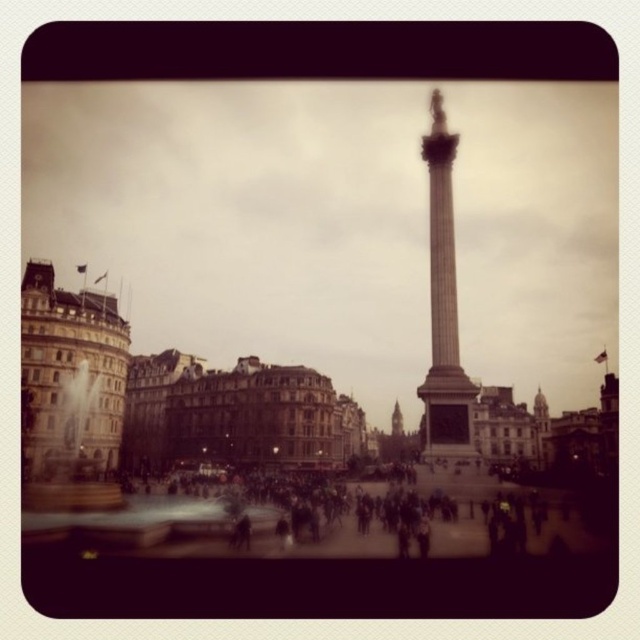
You are a photographer standing at the edge of Trafalgar Square. You want to capture a clear shot of the smooth stone column at center without any obstructions from the dark clothing crowd at center. Based on their relative heights, is it possible to frame the shot so the column remains fully visible?

The dark clothing crowd at center is shorter than the smooth stone column at center, so yes, it is possible to frame the shot so the column remains fully visible as the crowd won

You are a photographer planning to capture a wide shot of the historical monument in Trafalgar Square. You notice the dark clothing crowd at center and the stone clock tower at center. Which of these two objects occupies more horizontal space in your photo?

The dark clothing crowd at center occupies more horizontal space in the photo than the stone clock tower at center because its width surpasses that of the stone clock tower at center.